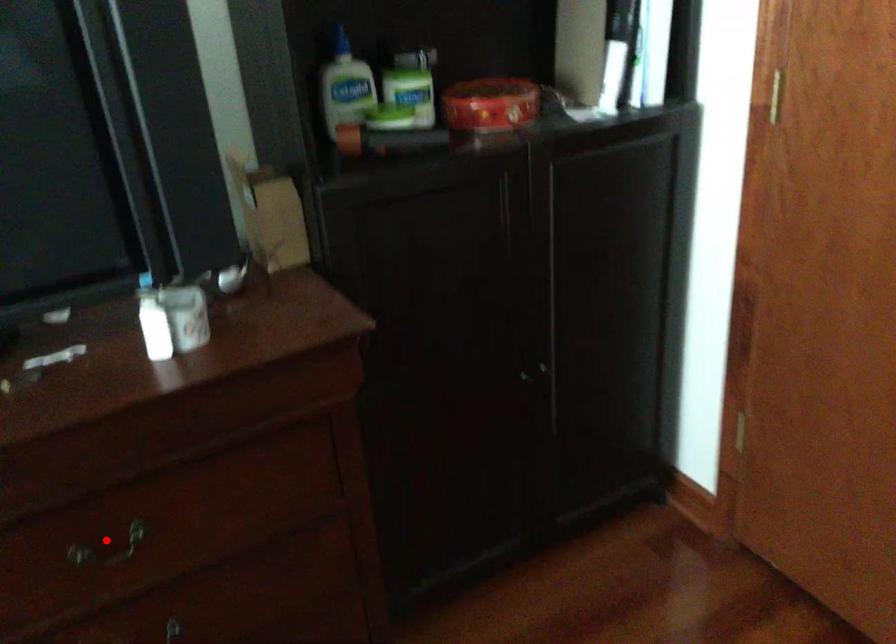
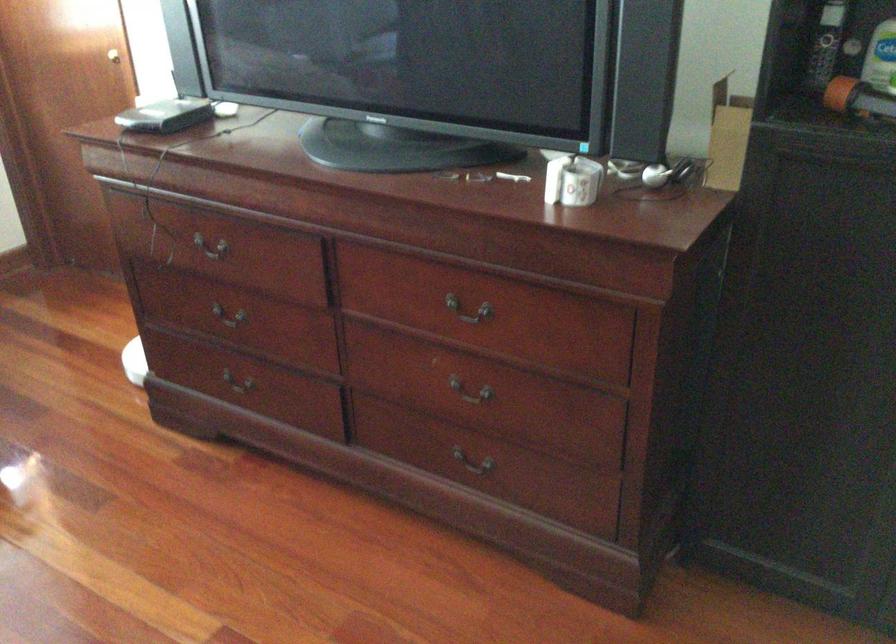
Locate, in the second image, the point that corresponds to the highlighted location in the first image.

(469, 310)